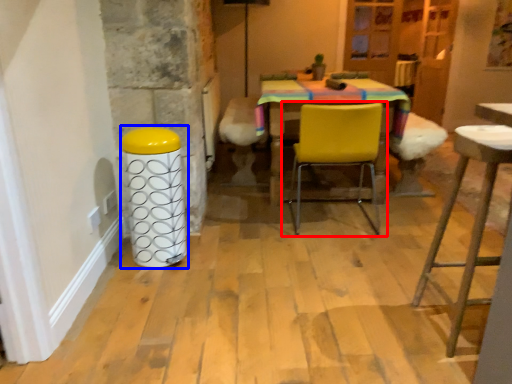
Question: Which object is closer to the camera taking this photo, chair (highlighted by a red box) or bar stool (highlighted by a blue box)?

Choices:
 (A) chair
 (B) bar stool

Answer: (B)